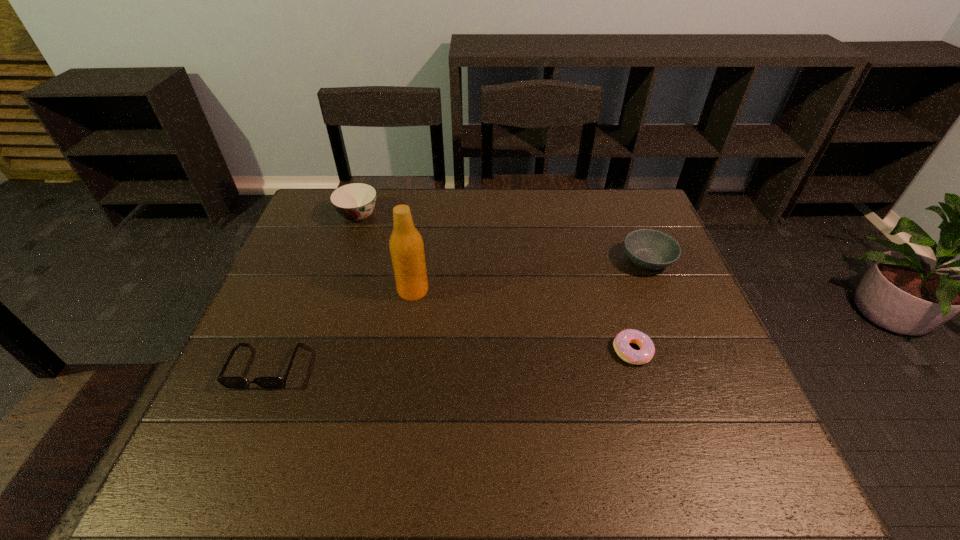
You are a GUI agent. You are given a task and a screenshot of the screen. Output one action in this format:
    pyautogui.click(x=<x>, y=<y>)
    Task: Click on the vacant region located on the back of the shorter soup bowl
    
    Given the screenshot: What is the action you would take?
    [621, 197]

Identify the location of vacant space located on the front-facing side of the sunglasses. (231, 450).

Locate an element on the screen. The height and width of the screenshot is (540, 960). free point located 0.170m on the back of the doughnut is located at coordinates (612, 286).

At what (x,y) coordinates should I click in order to perform the action: click on object that is at the far edge. Please return your answer as a coordinate pair (x, y). This screenshot has width=960, height=540. Looking at the image, I should click on (355, 201).

You are a GUI agent. You are given a task and a screenshot of the screen. Output one action in this format:
    pyautogui.click(x=<x>, y=<y>)
    Task: Click on the soup bowl at the left edge
    The width and height of the screenshot is (960, 540).
    Given the screenshot: What is the action you would take?
    pyautogui.click(x=355, y=201)

In order to click on sunglasses present at the left edge in this screenshot , I will do `click(228, 382)`.

You are a GUI agent. You are given a task and a screenshot of the screen. Output one action in this format:
    pyautogui.click(x=<x>, y=<y>)
    Task: Click on the soup bowl located in the right edge section of the desktop
    This screenshot has width=960, height=540.
    Given the screenshot: What is the action you would take?
    pyautogui.click(x=648, y=249)

The height and width of the screenshot is (540, 960). Identify the location of doughnut that is positioned at the right edge. (621, 345).

Identify the location of object located at the far left corner. (355, 201).

Locate an element on the screen. This screenshot has width=960, height=540. vacant area at the far edge is located at coordinates (514, 218).